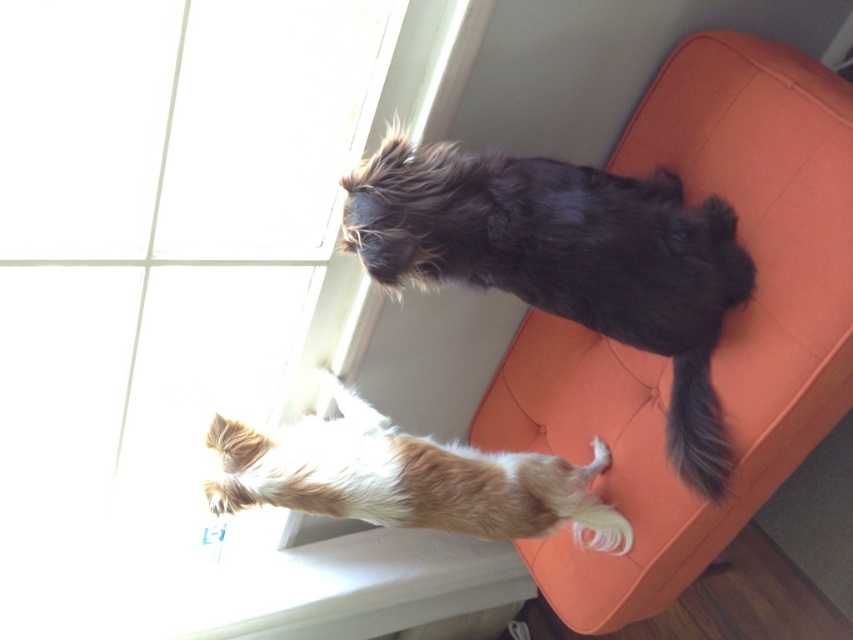
Question: Does shaggy black dog at upper right appear on the right side of brown fur dog at upper right?

Choices:
 (A) no
 (B) yes

Answer: (B)

Question: Which point is closer to the camera?

Choices:
 (A) (508, 262)
 (B) (575, 499)

Answer: (A)

Question: Which of these objects is positioned farthest from the blue silky tail at lower right?

Choices:
 (A) brown fur dog at upper right
 (B) shaggy black dog at upper right
 (C) transparent glass window at upper left

Answer: (C)

Question: Estimate the real-world distances between objects in this image. Which object is closer to the shaggy black dog at upper right?

Choices:
 (A) brown fur dog at upper right
 (B) transparent glass window at upper left

Answer: (A)

Question: Can you confirm if shaggy black dog at upper right is positioned to the right of brown fur dog at upper right?

Choices:
 (A) yes
 (B) no

Answer: (A)

Question: Can you confirm if transparent glass window at upper left is positioned to the right of shaggy black dog at upper right?

Choices:
 (A) yes
 (B) no

Answer: (B)